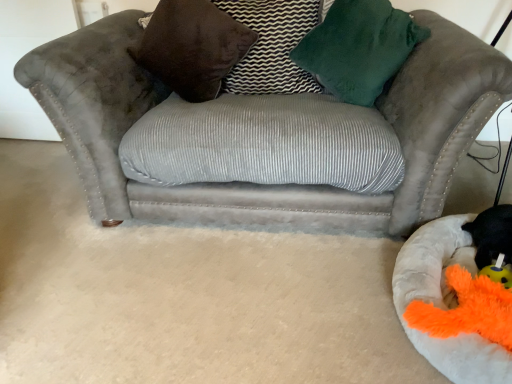
The height and width of the screenshot is (384, 512). I want to click on vacant space that is to the left of fluffy white dog bed at lower right, so click(x=300, y=294).